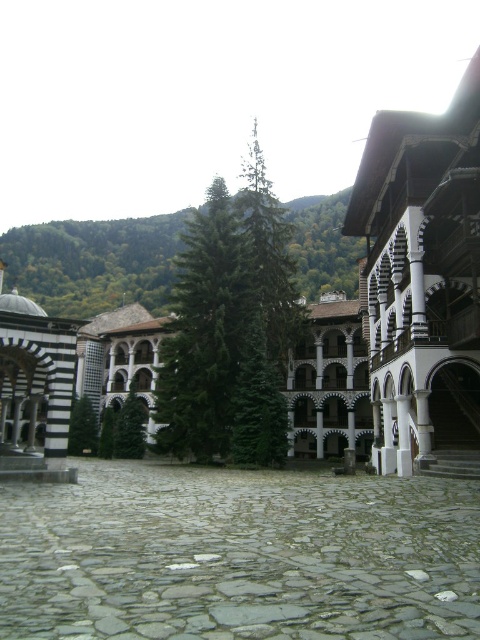
Which is below, gray stone courtyard at center or white wood palace at right?

gray stone courtyard at center

Does gray stone courtyard at center appear on the right side of white wood palace at right?

Incorrect, gray stone courtyard at center is not on the right side of white wood palace at right.

Is point (132, 493) in front of point (394, 154)?

Yes, it is.

The width and height of the screenshot is (480, 640). In order to click on gray stone courtyard at center in this screenshot , I will do `click(238, 554)`.

Describe the element at coordinates (422, 284) in the screenshot. The image size is (480, 640). I see `white wood palace at right` at that location.

Between white wood palace at right and green textured tree at center, which one appears on the left side from the viewer's perspective?

green textured tree at center is more to the left.

Is point (466, 92) farther from camera compared to point (95, 428)?

No, it is not.

I want to click on white wood palace at right, so click(x=422, y=284).

Which is below, white stone palace at center or green textured tree at center?

green textured tree at center is lower down.

Can you confirm if white stone palace at center is wider than green textured tree at center?

Correct, the width of white stone palace at center exceeds that of green textured tree at center.

Is point (337, 422) positioned in front of point (96, 436)?

Yes, it is in front of point (96, 436).

Find the location of a particular element. The width and height of the screenshot is (480, 640). white stone palace at center is located at coordinates (330, 381).